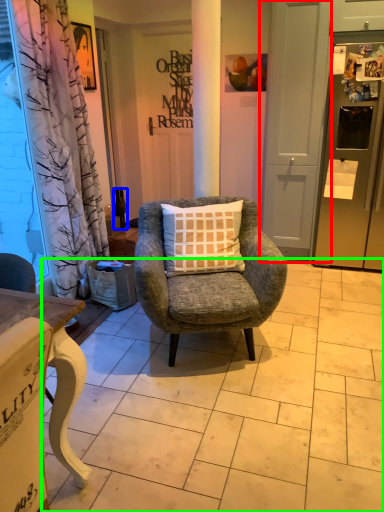
Question: Which is nearer to the screen door (highlighted by a red box)? bottle (highlighted by a blue box) or tile (highlighted by a green box).

Choices:
 (A) bottle
 (B) tile

Answer: (A)